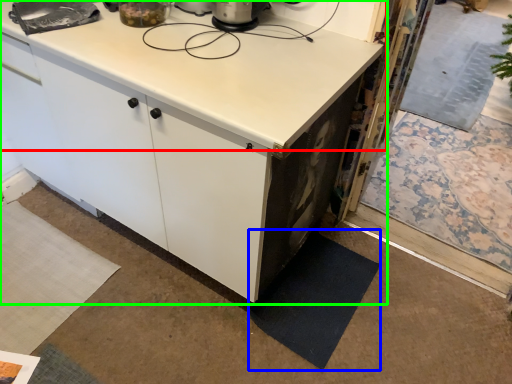
Question: Which object is the farthest from countertop (highlighted by a red box)? Choose among these: mat (highlighted by a blue box) or cabinetry (highlighted by a green box).

Choices:
 (A) mat
 (B) cabinetry

Answer: (A)